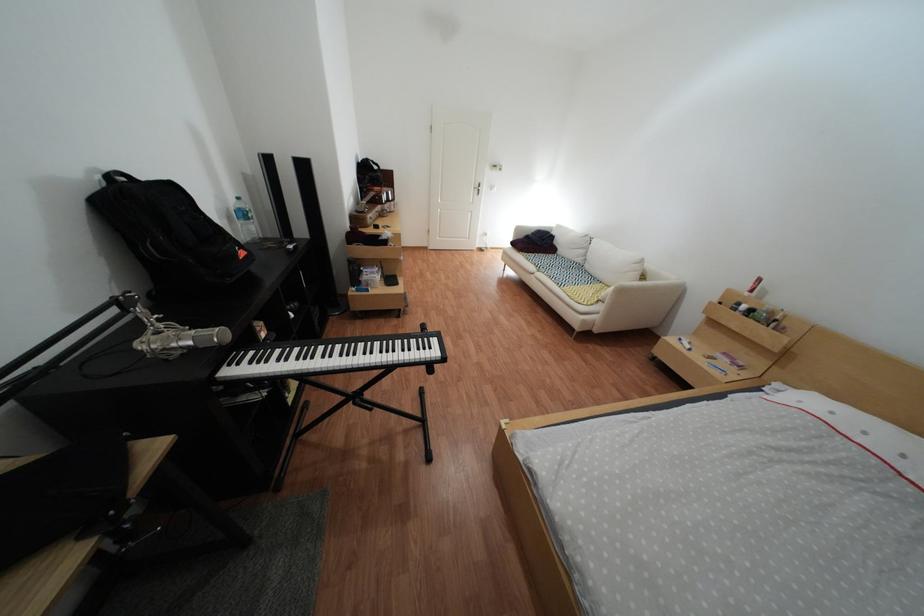
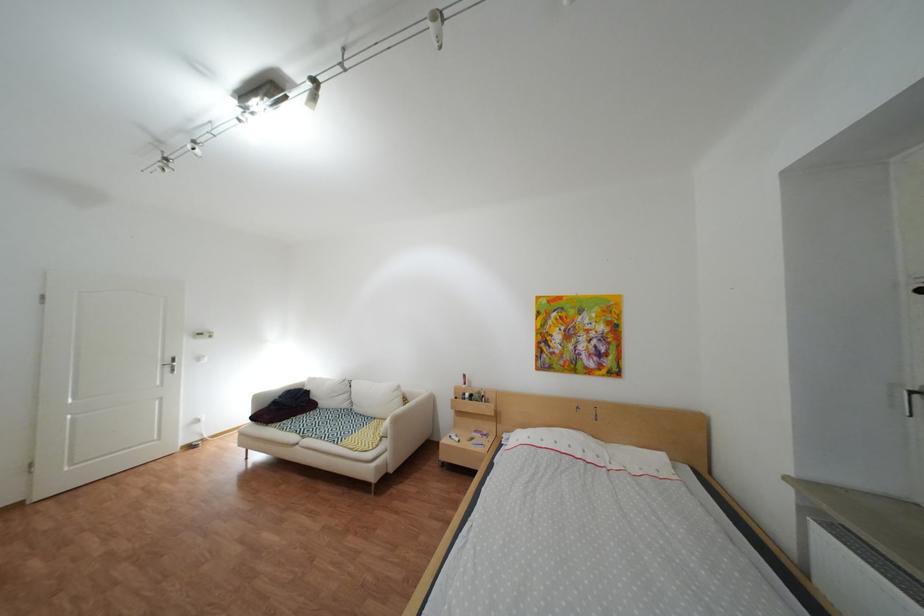
Locate, in the second image, the point that corresponds to pixel 658 262 in the first image.

(415, 389)